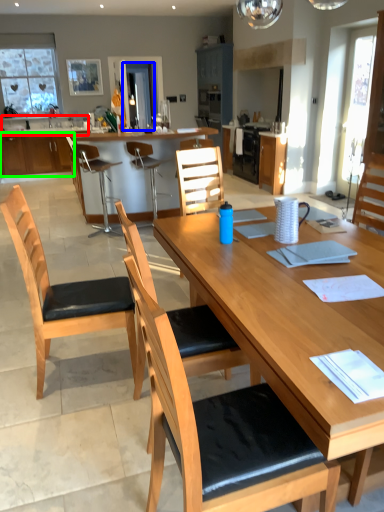
Question: Which object is positioned closest to sink (highlighted by a red box)? Select from glass door (highlighted by a blue box) and cabinetry (highlighted by a green box).

Choices:
 (A) glass door
 (B) cabinetry

Answer: (B)